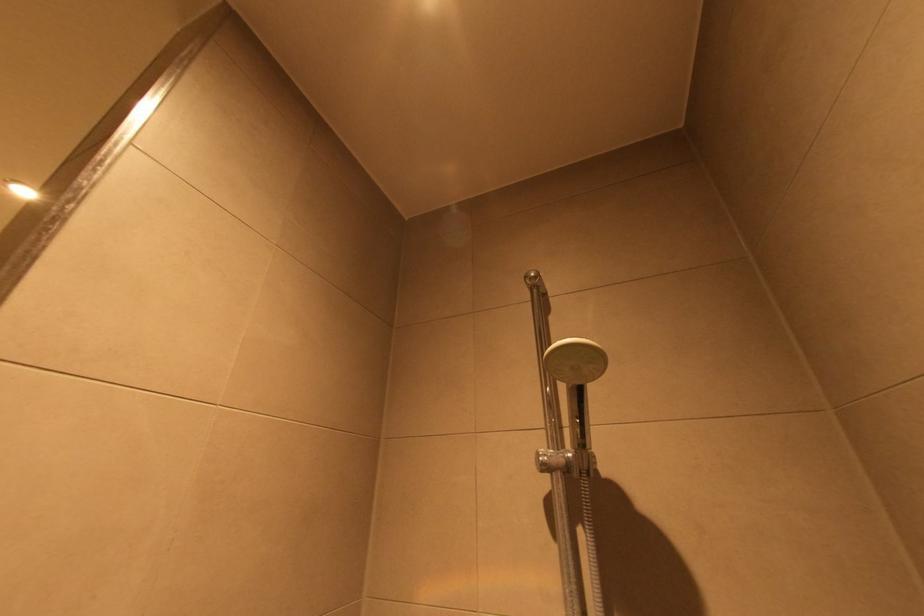
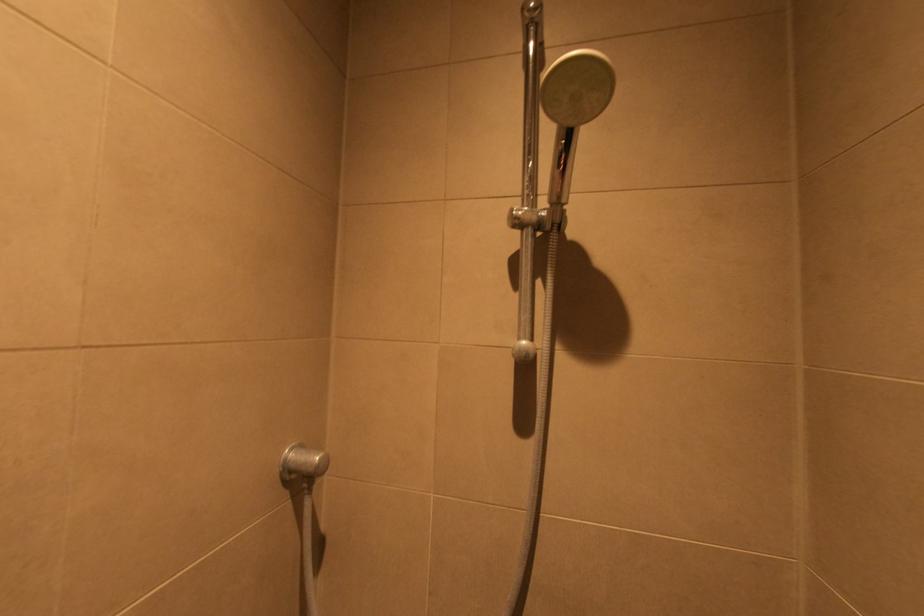
Question: Based on the continuous images, in which direction is the camera rotating? Reply with the corresponding letter.

Choices:
 (A) Left
 (B) Right
 (C) Up
 (D) Down

Answer: (D)